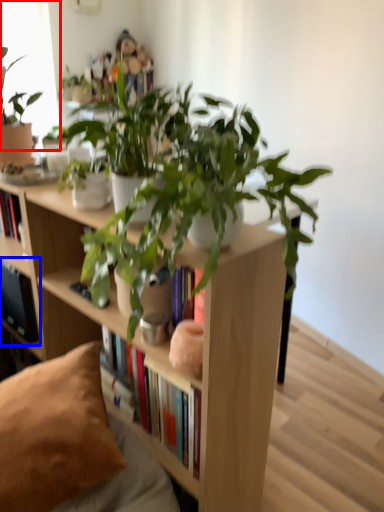
Question: Among these objects, which one is nearest to the camera, window screen (highlighted by a red box) or shelf (highlighted by a blue box)?

Choices:
 (A) window screen
 (B) shelf

Answer: (A)